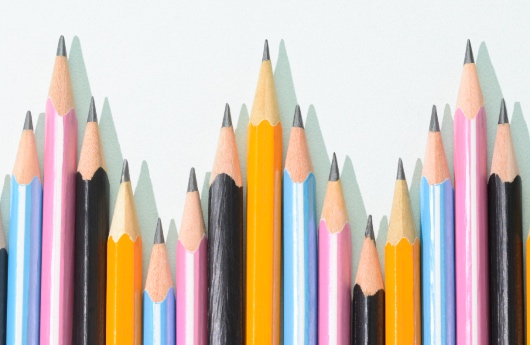
Locate an element on the screen. This screenshot has width=530, height=345. black or orange pencil is located at coordinates (2, 280), (89, 278), (130, 288), (229, 293), (258, 296), (373, 312), (398, 312), (501, 297), (526, 263).